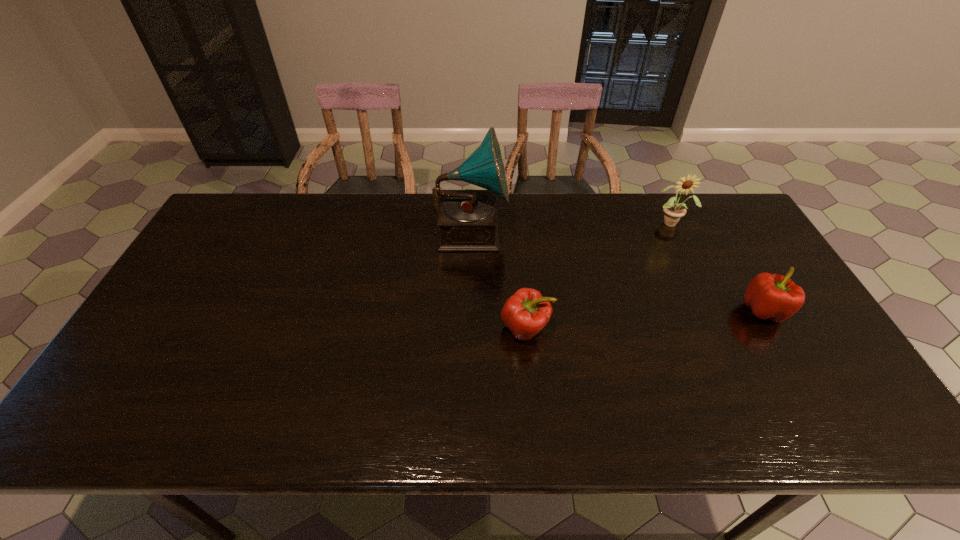
Identify the location of vacant space that's between the third shortest object and the tallest object. Image resolution: width=960 pixels, height=540 pixels. (571, 226).

Find the location of `free space between the rightmost object and the tallest object`. free space between the rightmost object and the tallest object is located at coordinates (617, 270).

At what (x,y) coordinates should I click in order to perform the action: click on vacant space that's between the third shortest object and the left bell pepper. Please return your answer as a coordinate pair (x, y). Looking at the image, I should click on [x=599, y=275].

Locate an element on the screen. The image size is (960, 540). free space between the tallest object and the left bell pepper is located at coordinates (499, 279).

Identify the location of blank region between the left bell pepper and the rightmost object. (645, 319).

At what (x,y) coordinates should I click in order to perform the action: click on vacant region between the second object from right to left and the rightmost object. Please return your answer as a coordinate pair (x, y). This screenshot has width=960, height=540. Looking at the image, I should click on (718, 267).

Where is `empty space between the second object from right to left and the left bell pepper`? Image resolution: width=960 pixels, height=540 pixels. empty space between the second object from right to left and the left bell pepper is located at coordinates click(599, 275).

Locate an element on the screen. Image resolution: width=960 pixels, height=540 pixels. free space between the record player and the left bell pepper is located at coordinates (499, 279).

Find the location of a particular element. The width and height of the screenshot is (960, 540). the third closest object to the left bell pepper is located at coordinates (775, 297).

Locate an element on the screen. This screenshot has width=960, height=540. object identified as the third closest to the right bell pepper is located at coordinates (468, 219).